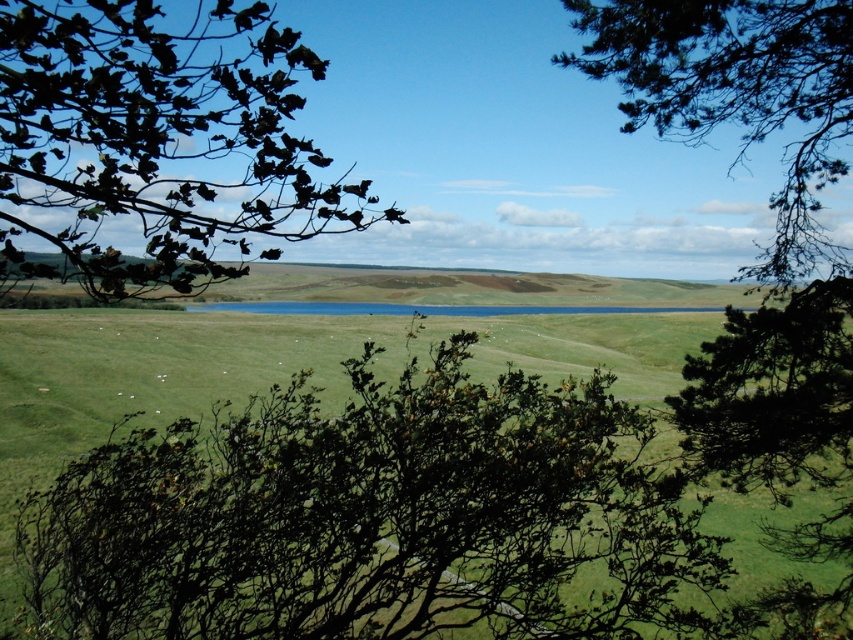
Consider the image. Between green leafy tree at center and green needle-like branches at upper right, which one appears on the left side from the viewer's perspective?

green leafy tree at center

Which is more to the right, green leafy tree at center or green needle-like branches at upper right?

Positioned to the right is green needle-like branches at upper right.

Which is in front, point (714, 564) or point (756, 104)?

Point (714, 564)

The image size is (853, 640). Find the location of `green leafy tree at center`. green leafy tree at center is located at coordinates (370, 516).

Based on the photo, is green leafy tree at center shorter than green leafy branches at upper left?

Yes, green leafy tree at center is shorter than green leafy branches at upper left.

Where is `green leafy tree at center`? green leafy tree at center is located at coordinates (370, 516).

Does green leafy branches at upper left appear on the right side of green needle-like branches at upper right?

Incorrect, green leafy branches at upper left is not on the right side of green needle-like branches at upper right.

Does green leafy branches at upper left appear under green needle-like branches at upper right?

No.

Which is in front, point (73, 12) or point (654, 116)?

Positioned in front is point (73, 12).

Where is `green leafy branches at upper left`? The width and height of the screenshot is (853, 640). green leafy branches at upper left is located at coordinates (155, 140).